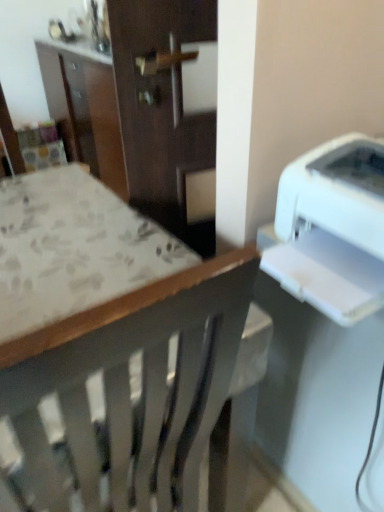
Image resolution: width=384 pixels, height=512 pixels. What are the coordinates of `blank space situated above wooden chair at center (from a real-world perspective)` in the screenshot? It's located at (69, 233).